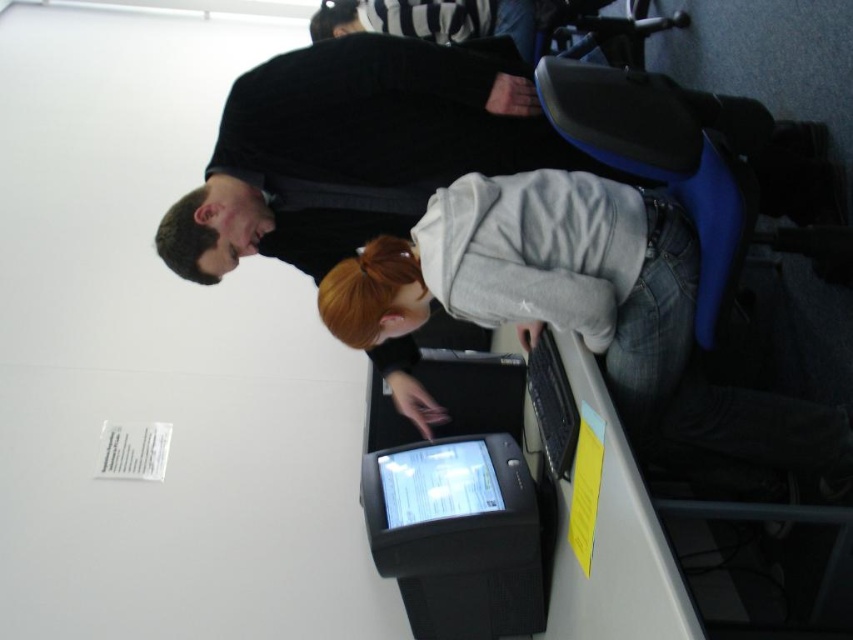
Question: Can you confirm if black glossy monitor at center is thinner than black glossy tablet at center?

Choices:
 (A) no
 (B) yes

Answer: (B)

Question: Can you confirm if black glossy monitor at center is positioned above striped fabric shirt at upper center?

Choices:
 (A) no
 (B) yes

Answer: (A)

Question: Which point appears farthest from the camera in this image?

Choices:
 (A) (427, 29)
 (B) (439, 490)

Answer: (A)

Question: Which of the following is the closest to the observer?

Choices:
 (A) (431, 540)
 (B) (389, 435)
 (C) (688, 445)

Answer: (C)

Question: Is gray fleece hoodie at center bigger than black glossy monitor at center?

Choices:
 (A) no
 (B) yes

Answer: (B)

Question: Which point is closer to the camera taking this photo?

Choices:
 (A) (488, 496)
 (B) (569, 188)

Answer: (B)